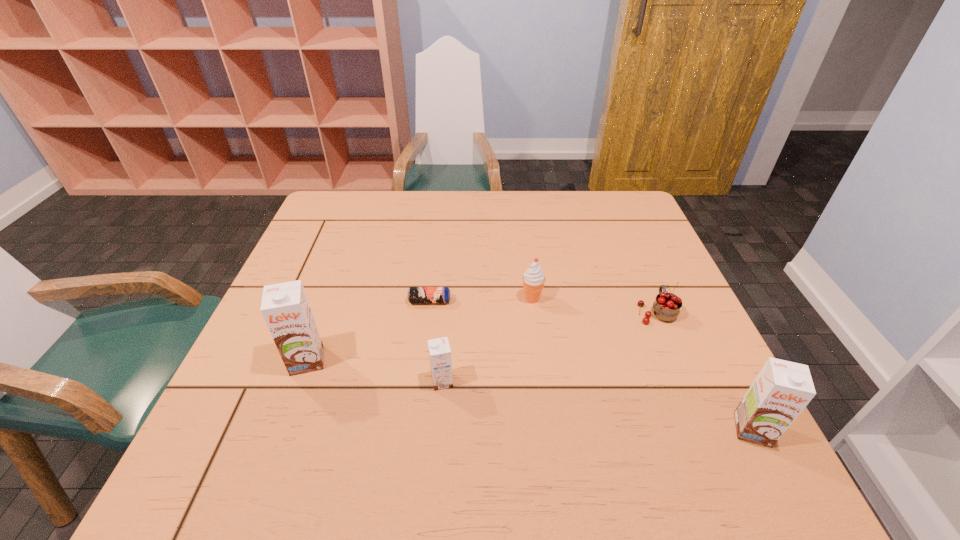
At what (x,y) coordinates should I click in order to perform the action: click on the leftmost chocolate milk. Please return your answer as a coordinate pair (x, y). This screenshot has height=540, width=960. Looking at the image, I should click on (285, 307).

Find the location of `the second chocolate milk from right to left`. the second chocolate milk from right to left is located at coordinates (439, 350).

Find the location of `the rightmost object`. the rightmost object is located at coordinates (782, 389).

Identify the location of the second tallest chocolate milk. (782, 389).

The width and height of the screenshot is (960, 540). In order to click on the fourth object from left to right in this screenshot , I will do `click(533, 279)`.

Locate an element on the screen. Image resolution: width=960 pixels, height=540 pixels. the shortest object is located at coordinates (415, 294).

The image size is (960, 540). Identify the location of cherry. (667, 306).

Find the location of a particular element. This screenshot has height=540, width=960. the fifth tallest object is located at coordinates (667, 306).

Identify the location of vacant space located on the back of the leftmost object. 326,308.

The height and width of the screenshot is (540, 960). I want to click on free spot located 0.080m on the right of the shortest chocolate milk, so click(x=492, y=381).